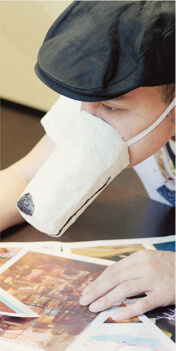
Locate an element on the screen. Image resolution: width=176 pixels, height=351 pixels. picture is located at coordinates (57, 308).